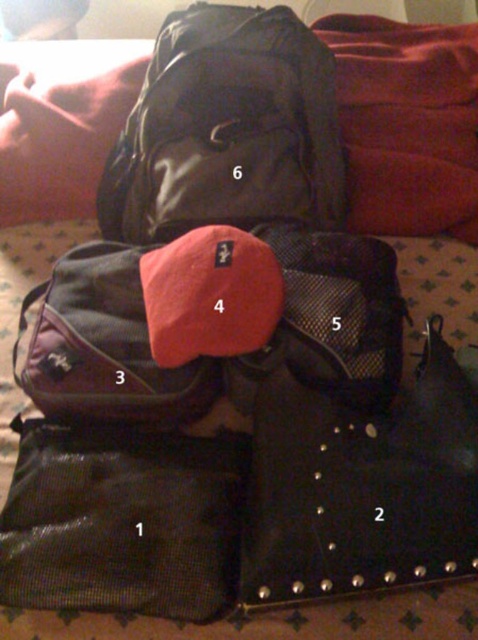
You are standing in front of the travel bags and accessories arranged on the patterned surface. You need to pick up the item located at point (291, 550) first. Can you reach it without moving the item at point (162, 484)?

Yes, you can reach the item at point (291, 550) first because it is in front of the item at point (162, 484), so you don not need to move the latter to access it.

Which item is located at the coordinates point [122,522]?

The point [122,522] is on the black mesh bag at lower left.

Looking at this image, you are standing at the origin point of the coordinate system. You want to pick up the black studded bag at center. Which direction should you move to reach it?

You should move towards the point with coordinates 0.759 in both x and y directions to reach the black studded bag at center.